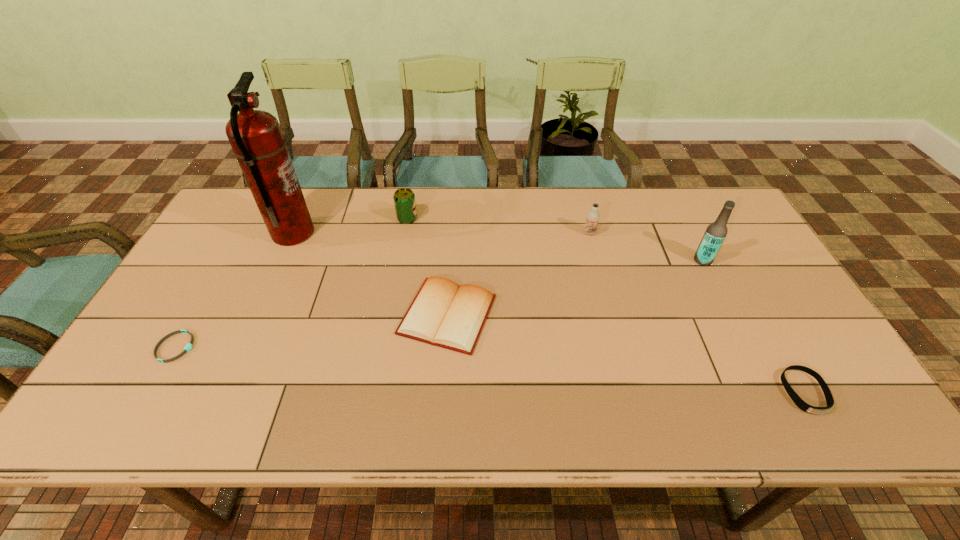
Find the location of a particular element. The width and height of the screenshot is (960, 540). the tallest object is located at coordinates (256, 138).

Find the location of a particular element. Image resolution: width=960 pixels, height=540 pixels. fire extinguisher is located at coordinates (256, 138).

Locate an element on the screen. This screenshot has height=540, width=960. the sixth shortest object is located at coordinates (716, 232).

This screenshot has height=540, width=960. Identify the location of the second object from right to left. (716, 232).

Find the location of `chocolate milk`. chocolate milk is located at coordinates (593, 216).

You are a GUI agent. You are given a task and a screenshot of the screen. Output one action in this format:
    pyautogui.click(x=<x>, y=<y>)
    Task: Click on the beer can
    
    Given the screenshot: What is the action you would take?
    pyautogui.click(x=404, y=199)

Find the location of a particular element. the fifth tallest object is located at coordinates (443, 313).

Identify the location of the sixth tallest object. This screenshot has width=960, height=540. (801, 404).

Where is `the taller wristband`? the taller wristband is located at coordinates (801, 404).

Image resolution: width=960 pixels, height=540 pixels. Identify the location of the shorter wristband. (188, 347).